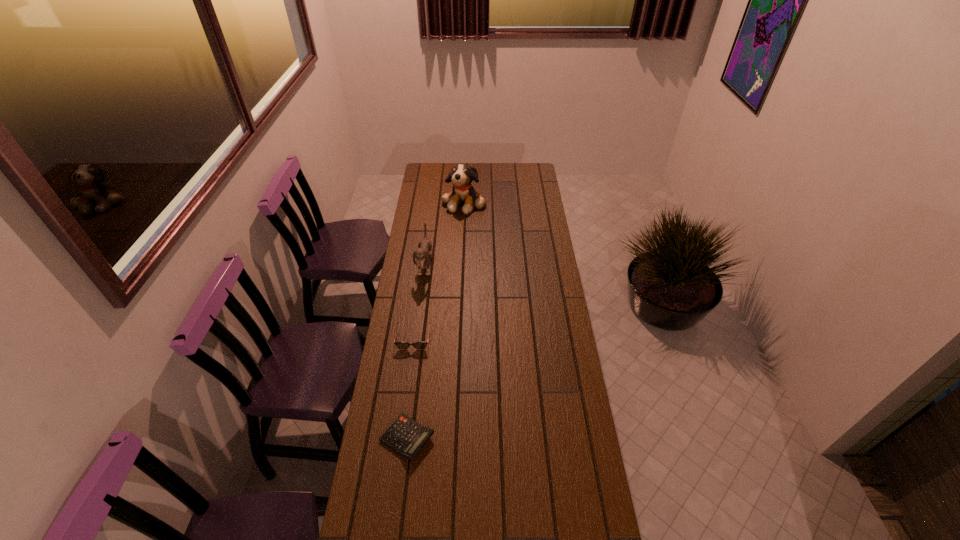
This screenshot has height=540, width=960. What are the coordinates of `blank region between the third nearest object and the farther puppy` in the screenshot? It's located at (444, 234).

Locate an element on the screen. vacant region between the third farthest object and the taller puppy is located at coordinates (439, 270).

Image resolution: width=960 pixels, height=540 pixels. I want to click on vacant space in between the farthest object and the left puppy, so click(x=444, y=234).

Where is `free spot between the left puppy and the third farthest object`? This screenshot has height=540, width=960. free spot between the left puppy and the third farthest object is located at coordinates (420, 302).

At what (x,y) coordinates should I click in order to perform the action: click on free space that is in between the shorter puppy and the nearest object. Please return your answer as a coordinate pair (x, y). The image size is (960, 540). Looking at the image, I should click on (416, 352).

Find the location of a particular element. The height and width of the screenshot is (540, 960). empty space between the tallest object and the shorter puppy is located at coordinates (444, 234).

I want to click on vacant region between the calculator and the farther puppy, so click(x=436, y=320).

Where is `free space that is in between the third nearest object and the calculator`? The width and height of the screenshot is (960, 540). free space that is in between the third nearest object and the calculator is located at coordinates (416, 352).

What are the coordinates of `free spot between the third shortest object and the farther puppy` in the screenshot? It's located at (444, 234).

Point out which object is positioned as the nearest to the farther puppy. Please provide its 2D coordinates. Your answer should be formatted as a tuple, i.e. [(x, y)], where the tuple contains the x and y coordinates of a point satisfying the conditions above.

[(422, 254)]